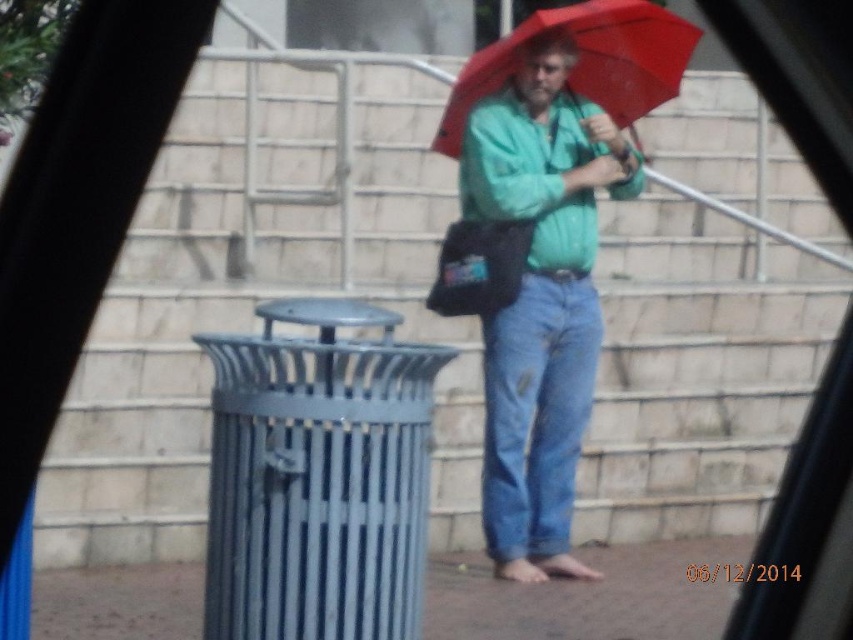
Question: Does green matte shirt at center appear on the right side of red matte umbrella at center?

Choices:
 (A) no
 (B) yes

Answer: (A)

Question: Does green matte shirt at center have a lesser width compared to red matte umbrella at center?

Choices:
 (A) no
 (B) yes

Answer: (B)

Question: Is green matte shirt at center behind red matte umbrella at center?

Choices:
 (A) yes
 (B) no

Answer: (A)

Question: Which point is closer to the camera taking this photo?

Choices:
 (A) (646, 40)
 (B) (541, 406)

Answer: (B)